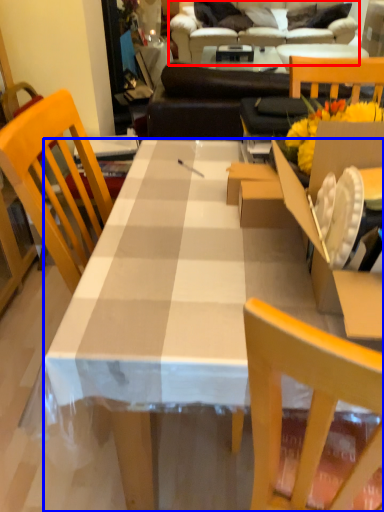
Question: Which of the following is the closest to the observer, studio couch (highlighted by a red box) or desk (highlighted by a blue box)?

Choices:
 (A) studio couch
 (B) desk

Answer: (B)